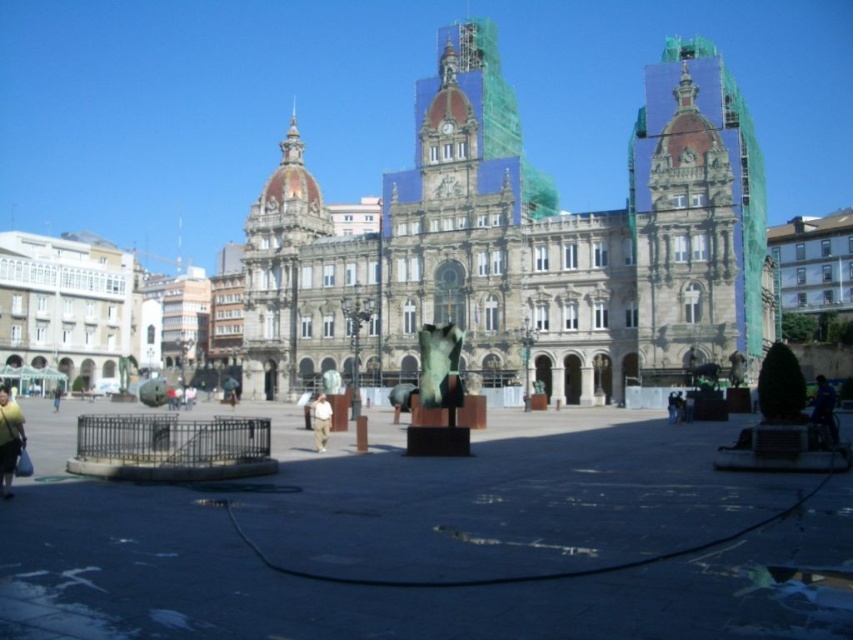
Question: Which of these objects is positioned closest to the brown fabric pants at center?

Choices:
 (A) green marble statue at center
 (B) dark blue fabric at lower right

Answer: (A)

Question: Where is brushed metal cage at center located in relation to light brown leather jacket at center in the image?

Choices:
 (A) above
 (B) below

Answer: (A)

Question: Which is nearer to the light brown leather jacket at lower left?

Choices:
 (A) bronze statue at center
 (B) light brown leather jacket at center
 (C) dark blue fabric at lower right
 (D) green marble statue at center

Answer: (B)

Question: Is bronze statue at center closer to camera compared to brushed metal cage at center?

Choices:
 (A) no
 (B) yes

Answer: (B)

Question: Where is stone building at center located in relation to light brown leather jacket at center in the image?

Choices:
 (A) left
 (B) right

Answer: (B)

Question: Which point appears farthest from the camera in this image?

Choices:
 (A) (242, 525)
 (B) (817, 416)

Answer: (B)